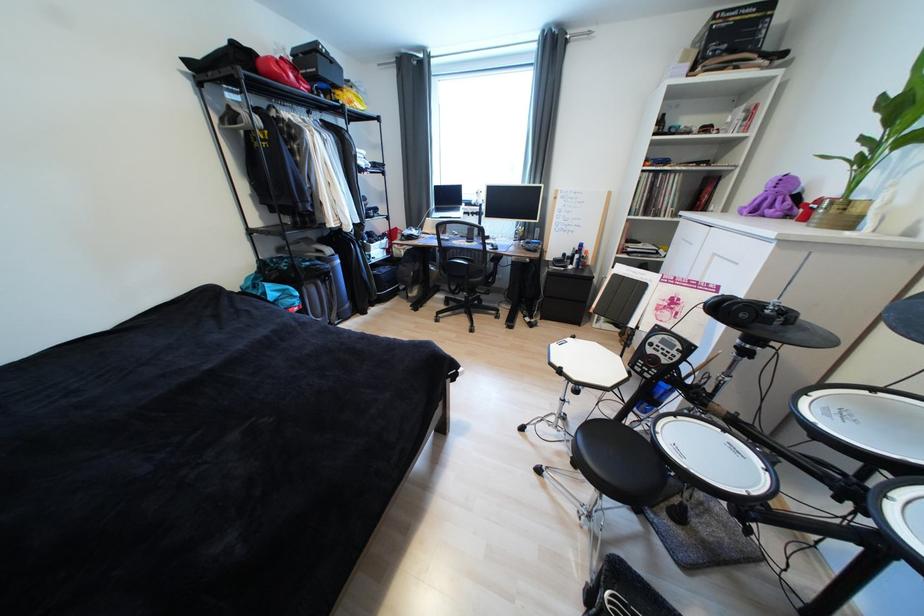
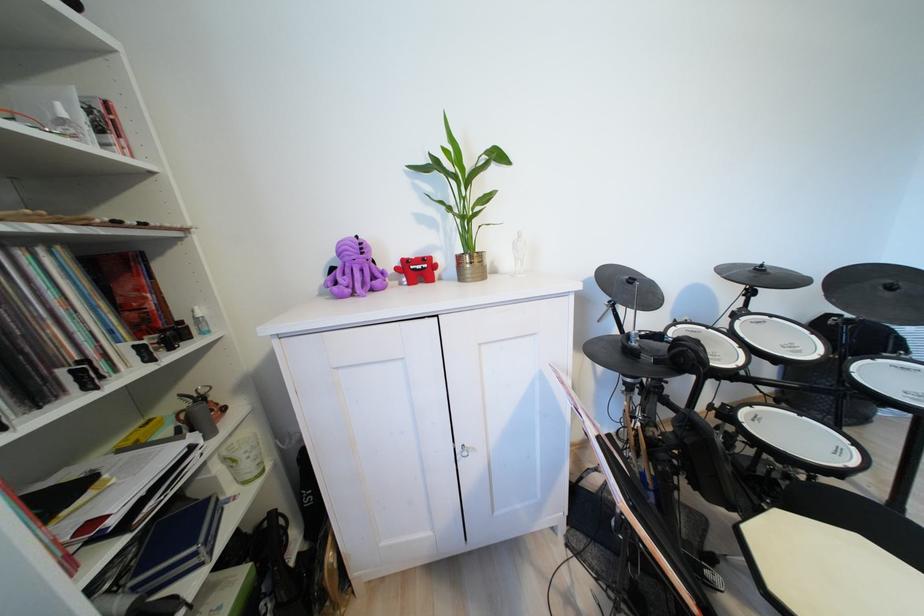
Find the pixel in the second image that matches point (787, 204) in the first image.

(360, 274)